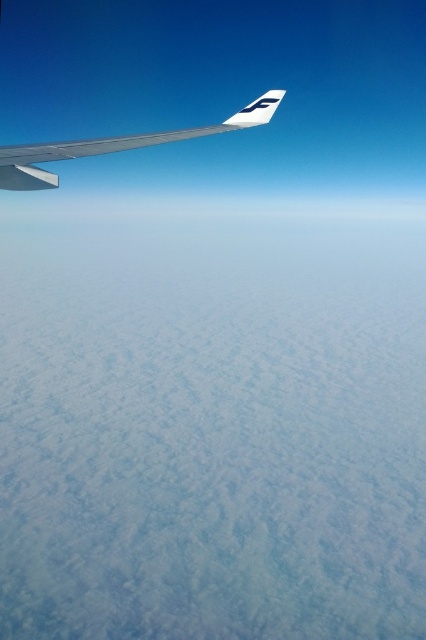
Question: Does white fluffy cloud at lower left come in front of metallic silver winglet at upper left?

Choices:
 (A) yes
 (B) no

Answer: (B)

Question: Which point is closer to the camera?

Choices:
 (A) (333, 202)
 (B) (13, 166)

Answer: (B)

Question: Can you confirm if white fluffy cloud at lower left is bigger than metallic silver winglet at upper left?

Choices:
 (A) yes
 (B) no

Answer: (A)

Question: Which of the following is the closest to the observer?

Choices:
 (A) white fluffy cloud at lower left
 (B) metallic silver winglet at upper left

Answer: (B)

Question: Is white fluffy cloud at lower left wider than metallic silver winglet at upper left?

Choices:
 (A) no
 (B) yes

Answer: (B)